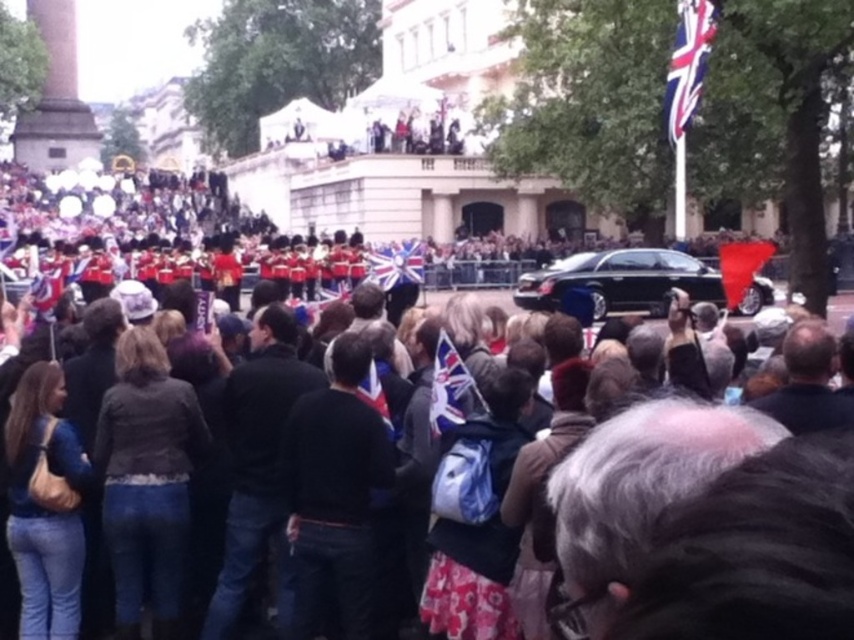
You are a photographer standing at the edge of the crowd. You want to take a photo that includes both the dark brown leather jacket at center and the black glossy car at center. Given that your camera has a maximum zoom range of 20 meters, can you capture both subjects in a single frame without moving your position?

The dark brown leather jacket at center is 21.97 meters from the black glossy car at center. Since your camera can only zoom up to 20 meters, you cannot capture both subjects in a single frame without moving your position.

Based on the photo, you are standing at the camera position and want to reach the point at coordinates [699,93]. The path is clear, but you have a 1.5 meter wide cart. Can you safely navigate to that point without hitting any obstacles?

The point at coordinates [699,93] is 80.30 meters away from the camera, so you can safely navigate to that point with your 1.5 meter wide cart as there are no obstacles mentioned in the scene description.